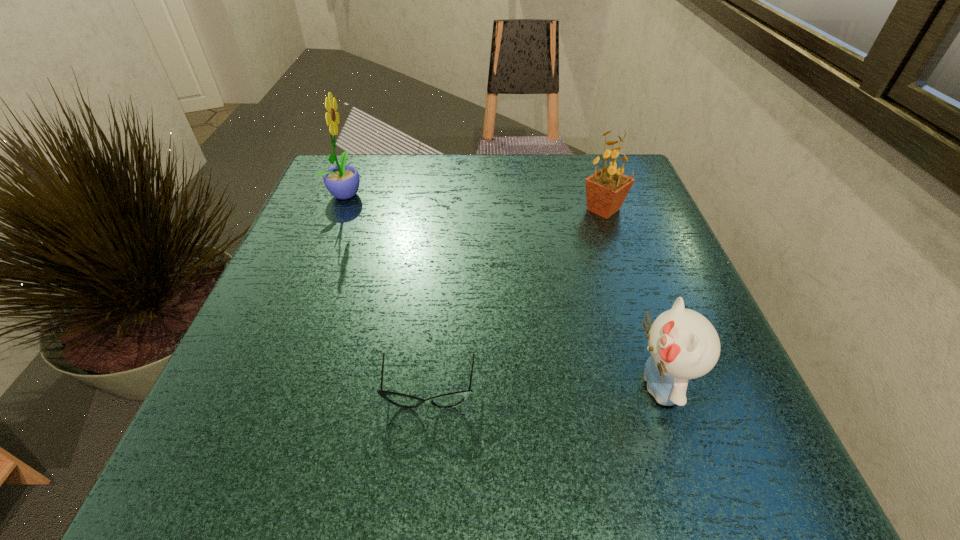
The image size is (960, 540). Identify the location of vacant position at the left edge of the desktop. (294, 248).

Identify the location of free space at the far left corner. The width and height of the screenshot is (960, 540). (327, 199).

Where is `vacant space at the near left corner of the desktop`? This screenshot has height=540, width=960. vacant space at the near left corner of the desktop is located at coordinates (243, 478).

In the image, there is a desktop. Where is `vacant space at the far right corner`? The width and height of the screenshot is (960, 540). vacant space at the far right corner is located at coordinates (633, 168).

The image size is (960, 540). Identify the location of unoccupied position between the right sunflower and the spectacles. (516, 300).

What are the coordinates of `blank region between the second shortest object and the left sunflower` in the screenshot? It's located at (503, 289).

The width and height of the screenshot is (960, 540). Find the location of `vacant area that lies between the right sunflower and the kitten`. vacant area that lies between the right sunflower and the kitten is located at coordinates (632, 298).

You are a GUI agent. You are given a task and a screenshot of the screen. Output one action in this format:
    pyautogui.click(x=<x>, y=<y>)
    Task: Click on the vacant region between the second object from left to right and the tallest object
    
    Given the screenshot: What is the action you would take?
    pyautogui.click(x=388, y=292)

The image size is (960, 540). In order to click on free spot between the shorter sunflower and the shortest object in this screenshot , I will do `click(516, 300)`.

Find the location of a particular element. This screenshot has height=540, width=960. free spot between the kitten and the second object from left to right is located at coordinates (544, 388).